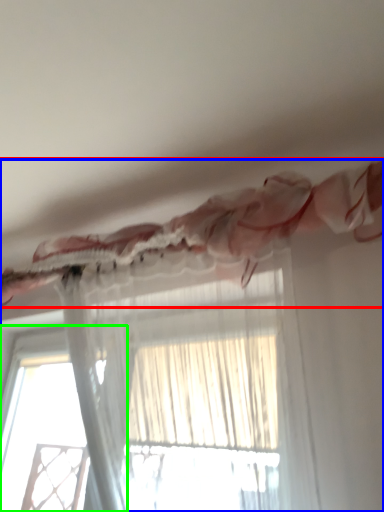
Question: Based on their relative distances, which object is nearer to curtain (highlighted by a red box)? Choose from curtain (highlighted by a blue box) and window (highlighted by a green box).

Choices:
 (A) curtain
 (B) window

Answer: (A)